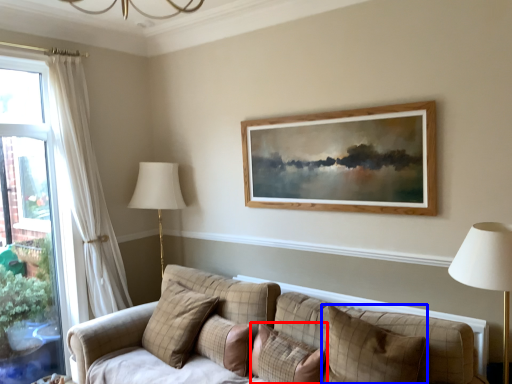
Question: Among these objects, which one is nearest to the camera, pillow (highlighted by a red box) or pillow (highlighted by a blue box)?

Choices:
 (A) pillow
 (B) pillow

Answer: (B)